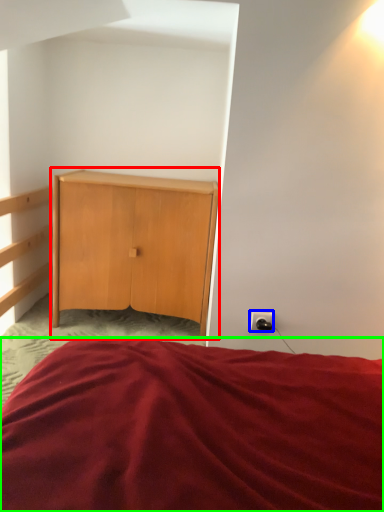
Question: Which is nearer to the nightstand (highlighted by a red box)? electric outlet (highlighted by a blue box) or bed (highlighted by a green box).

Choices:
 (A) electric outlet
 (B) bed

Answer: (A)